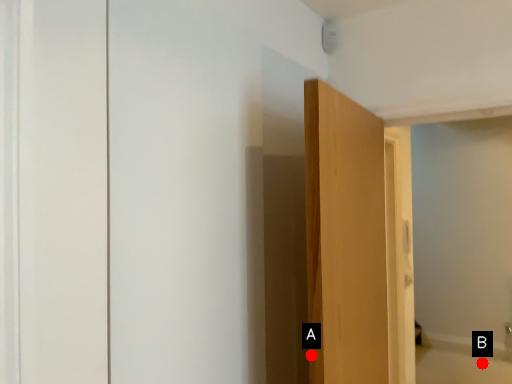
Question: Two points are circled on the image, labeled by A and B beside each circle. Which point is closer to the camera taking this photo?

Choices:
 (A) A is closer
 (B) B is closer

Answer: (A)